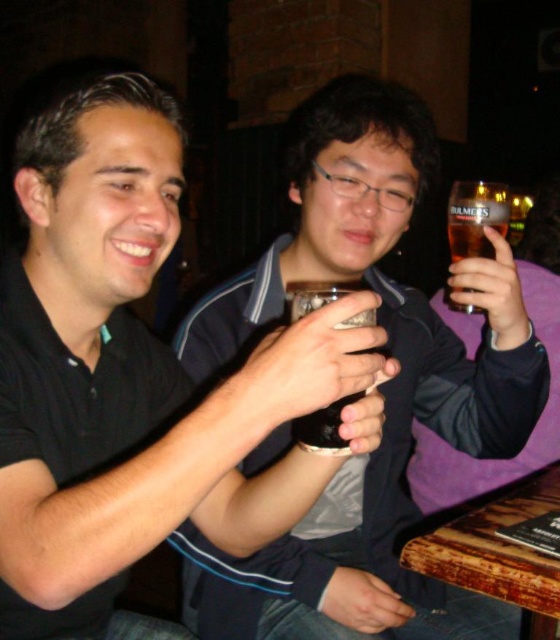
Question: Can you confirm if matte black mug at center is wider than dark brown glass at center?

Choices:
 (A) no
 (B) yes

Answer: (B)

Question: Which object is positioned farthest from the clear glass mug at upper right?

Choices:
 (A) dark brown glass at center
 (B) matte glass mug at center
 (C) matte black mug at center

Answer: (C)

Question: Does matte black mug at center appear over dark brown glass at center?

Choices:
 (A) no
 (B) yes

Answer: (A)

Question: Which is farther from the matte black mug at center?

Choices:
 (A) matte glass mug at center
 (B) dark brown glass at center

Answer: (A)

Question: Is matte glass mug at center above dark brown glass at center?

Choices:
 (A) no
 (B) yes

Answer: (A)

Question: Which point is farther to the camera?

Choices:
 (A) (88, 326)
 (B) (464, 228)

Answer: (B)